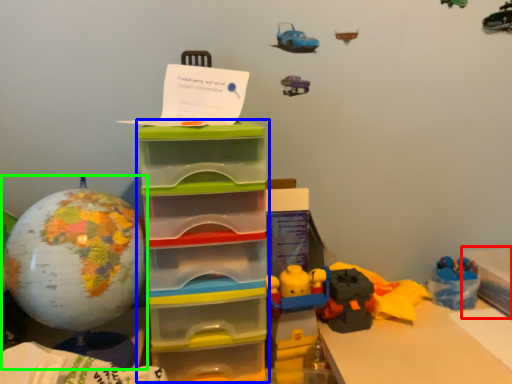
Question: Estimate the real-world distances between objects in this image. Which object is farther from storage box (highlighted by a red box), storage box (highlighted by a blue box) or toy (highlighted by a green box)?

Choices:
 (A) storage box
 (B) toy

Answer: (B)